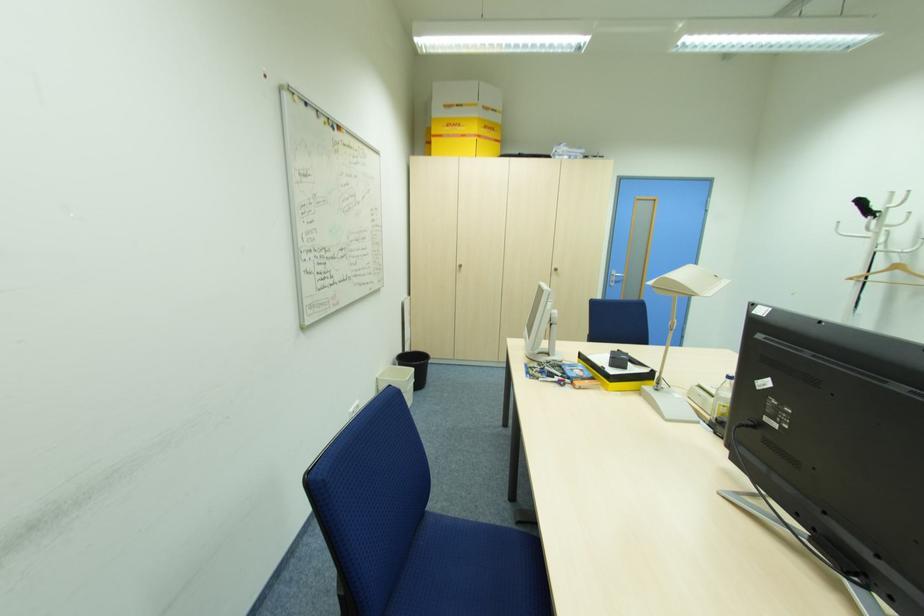
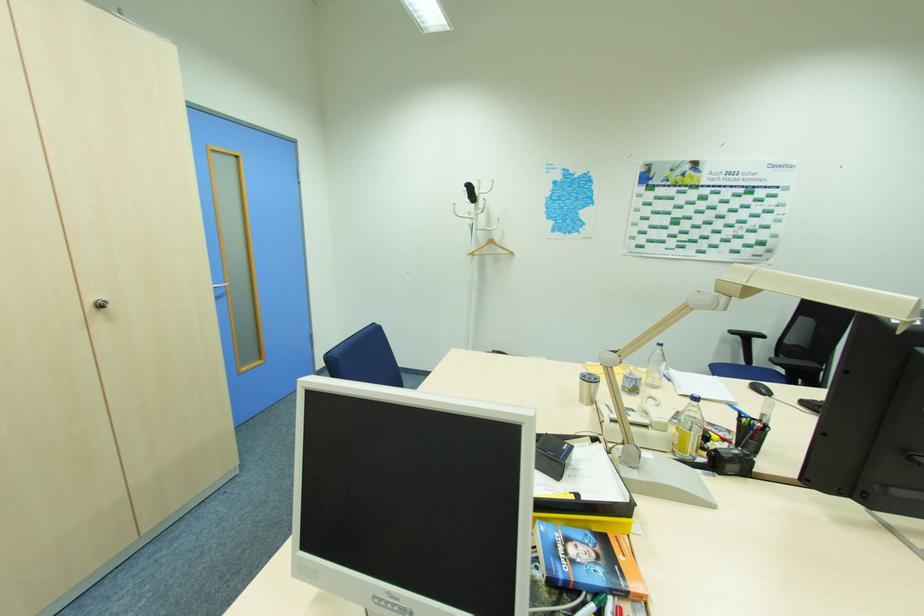
Where in the second image is the point corresponding to (842,235) from the first image?

(459, 216)